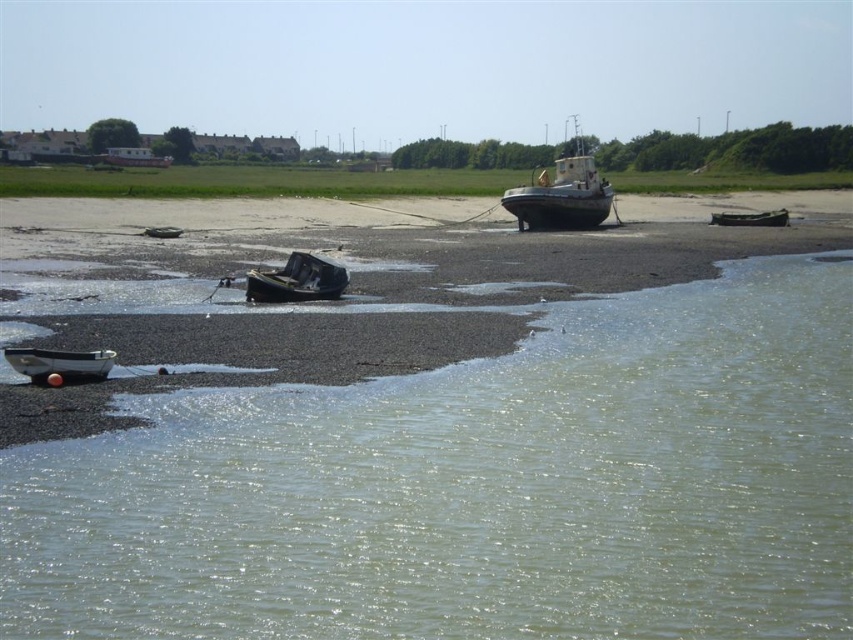
I want to click on smooth gray boat at center, so click(x=561, y=193).

Is smooth gray boat at center below wooden boat at center?

No, smooth gray boat at center is not below wooden boat at center.

Where is `smooth gray boat at center`? This screenshot has height=640, width=853. smooth gray boat at center is located at coordinates (561, 193).

At what (x,y) coordinates should I click in order to perform the action: click on smooth gray boat at center. Please return your answer as a coordinate pair (x, y). Looking at the image, I should click on (561, 193).

Can you confirm if clear water at lower left is thinner than smooth gray boat at center?

In fact, clear water at lower left might be wider than smooth gray boat at center.

Is point (277, 416) positioned before point (549, 204)?

Yes, point (277, 416) is closer to viewer.

What are the coordinates of `clear water at lower left` in the screenshot? It's located at (476, 486).

Does point (718, 218) come farther from viewer compared to point (167, 228)?

Yes, point (718, 218) is farther from viewer.

Which of these two, wooden boat at lower right or wooden boat at center, stands taller?

With more height is wooden boat at lower right.

This screenshot has height=640, width=853. What are the coordinates of `wooden boat at lower right` in the screenshot? It's located at (750, 218).

This screenshot has height=640, width=853. What are the coordinates of `wooden boat at lower right` in the screenshot? It's located at (750, 218).